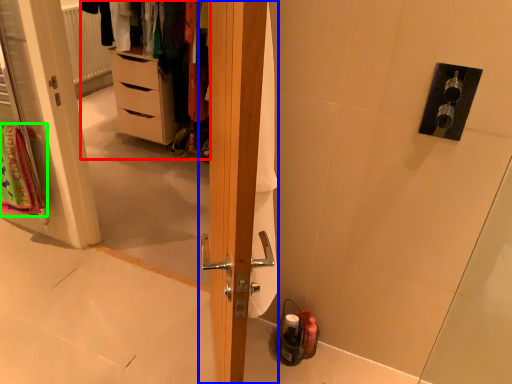
Question: Estimate the real-world distances between objects in this image. Which object is closer to dresser (highlighted by a red box), door (highlighted by a blue box) or bath towel (highlighted by a green box)?

Choices:
 (A) door
 (B) bath towel

Answer: (B)